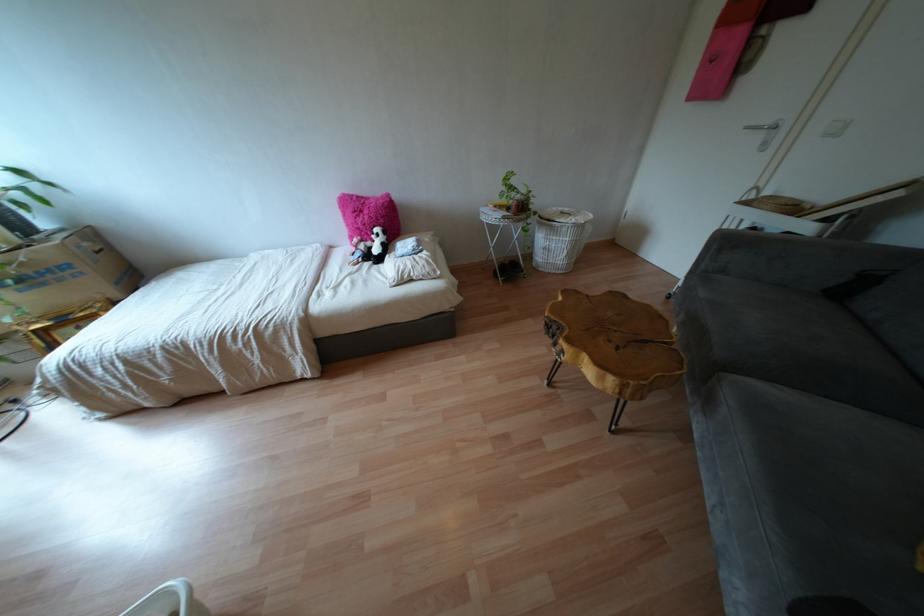
Locate an element on the screen. Image resolution: width=924 pixels, height=616 pixels. white light switch is located at coordinates (835, 128).